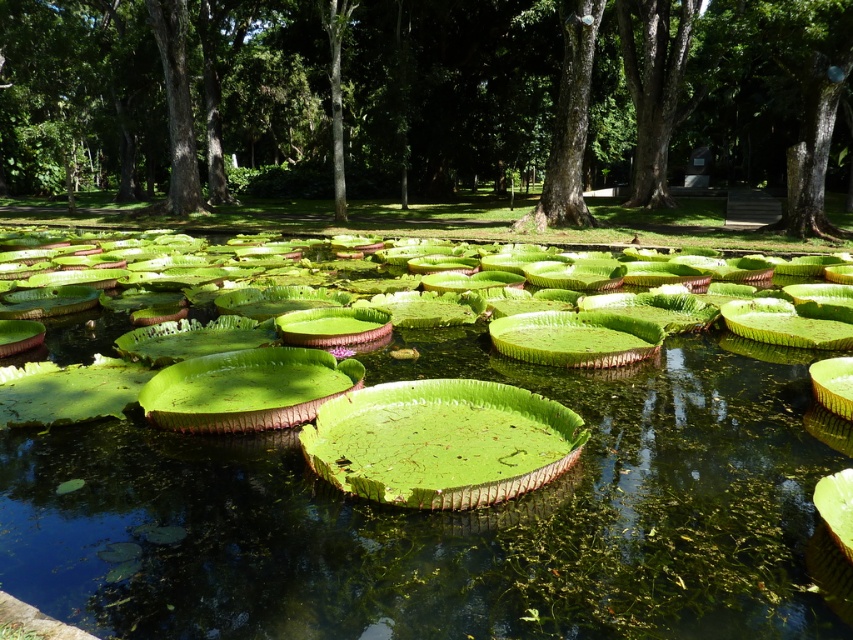
You are standing at the edge of the pond and want to reach the green leafy water at center. Which direction should you move to get there?

The green leafy water at center is located at coordinates approximately 0.808 on the x axis and 0.528 on the y axis. Since you are at the edge, you would need to move towards the center of the pond to reach it.

Consider the image. You are standing at the edge of the pond and want to throw a small stone to hit both the green leafy water at center and the smooth bark tree at center. Is it possible to do so with a single throw?

The green leafy water at center and the smooth bark tree at center are 16.57 meters apart. Since the distance between them is quite large, it would be challenging to throw a stone that far in a single throw to hit both targets. Therefore, it is unlikely possible to do so.